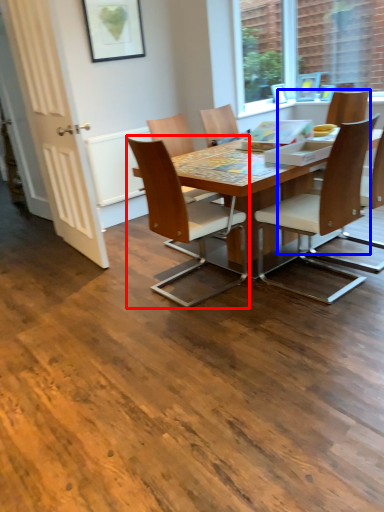
Question: Which object is further to the camera taking this photo, chair (highlighted by a red box) or chair (highlighted by a blue box)?

Choices:
 (A) chair
 (B) chair

Answer: (B)